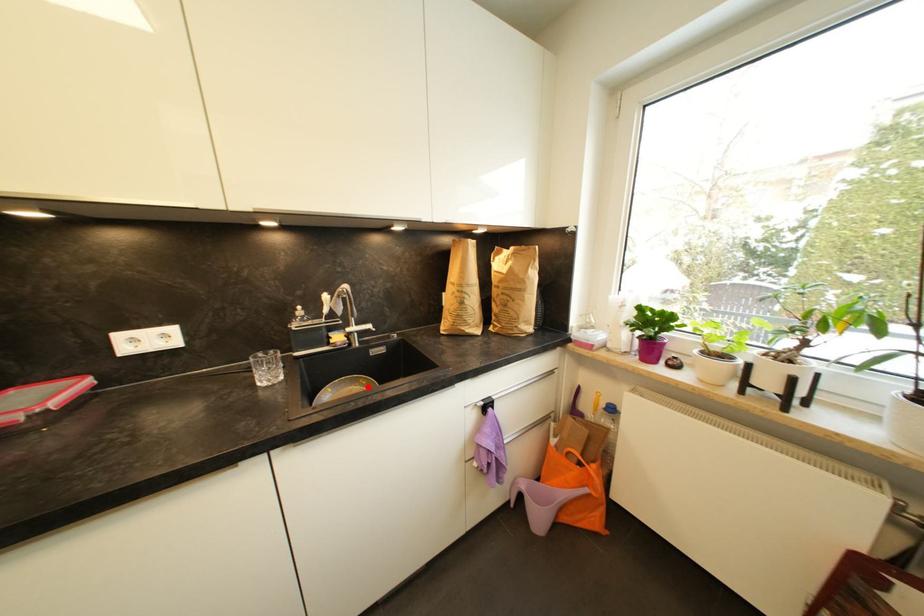
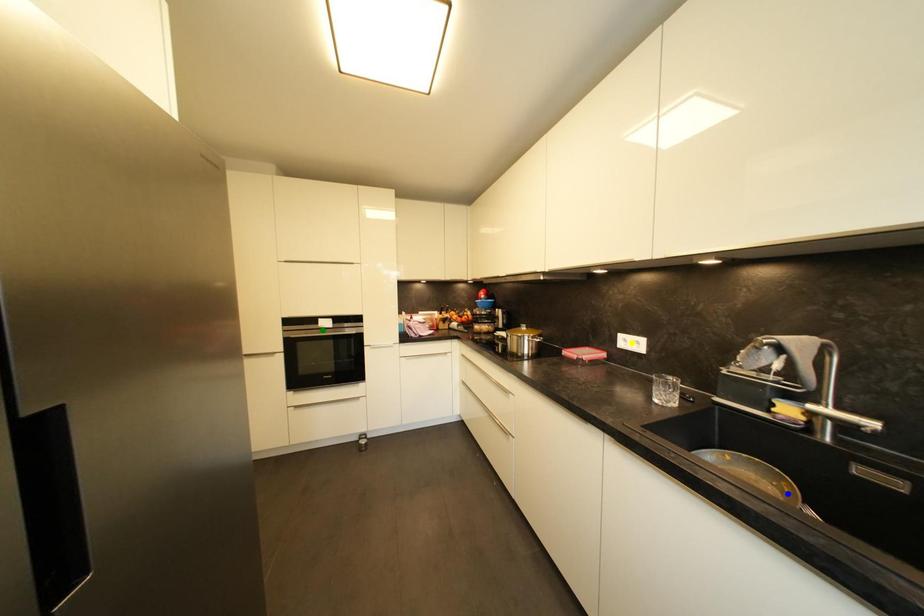
Question: I am providing you with two images of the same scene from different viewpoints. A red point is marked on the first image. You are given multiple points on the second image. Which mark in image 2 goes with the point in image 1?

Choices:
 (A) green point
 (B) yellow point
 (C) blue point

Answer: (C)